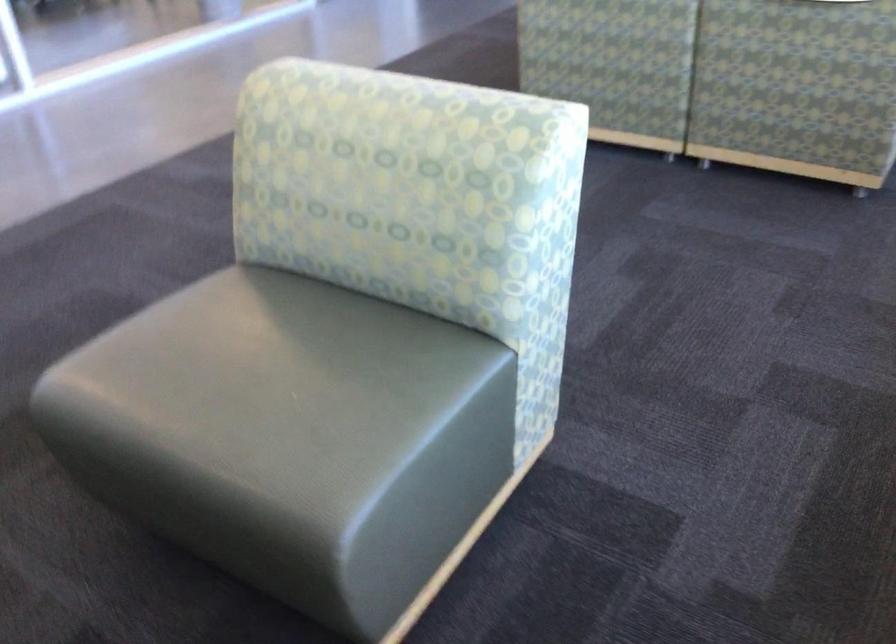
Find the location of `green chair sitting surface`. green chair sitting surface is located at coordinates (279, 389).